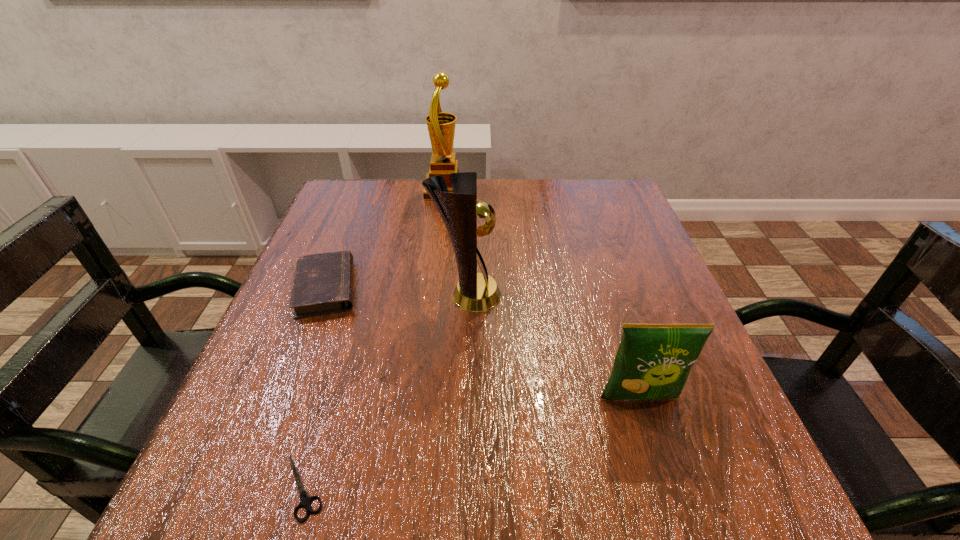
The image size is (960, 540). What are the coordinates of `free space at the left edge` in the screenshot? It's located at (286, 323).

Locate an element on the screen. vacant region at the right edge of the desktop is located at coordinates (610, 271).

In the image, there is a desktop. Identify the location of vacant space at the far left corner. This screenshot has height=540, width=960. (384, 202).

I want to click on free space at the near left corner of the desktop, so click(273, 472).

Identify the location of free space at the far right corner of the desktop. The width and height of the screenshot is (960, 540). (583, 217).

The image size is (960, 540). I want to click on free spot between the nearer award and the crisp (potato chip), so click(x=553, y=347).

The width and height of the screenshot is (960, 540). What are the coordinates of `free space that is in between the nearest object and the farthest object` in the screenshot? It's located at click(374, 339).

Locate an element on the screen. The height and width of the screenshot is (540, 960). free space between the nearer award and the shears is located at coordinates (385, 392).

The image size is (960, 540). What are the coordinates of `vacant area that lies between the nearer award and the fourth tallest object` in the screenshot? It's located at (396, 292).

Find the location of a particular element. Image resolution: width=960 pixels, height=540 pixels. blank region between the rightmost object and the farther award is located at coordinates (542, 294).